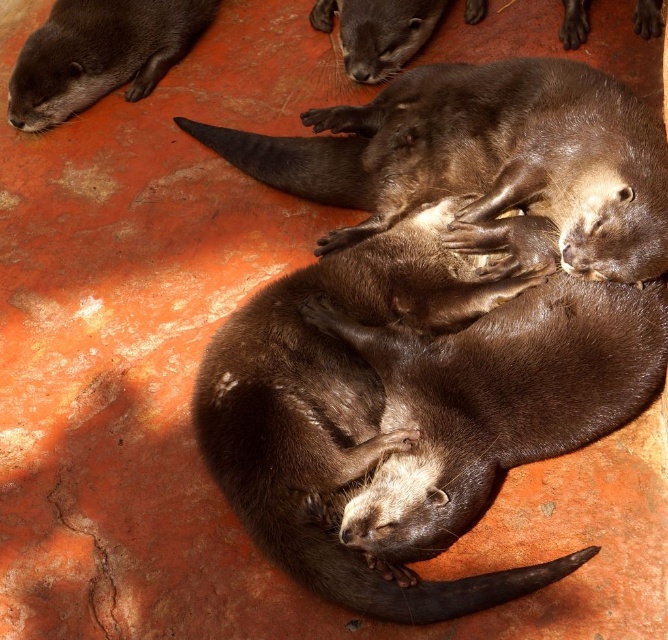
You are an animal caretaker observing the otters. You need to determine which otter is larger in height between the brown shiny otter at center and the shiny brown otter at upper left. Which one is taller?

The brown shiny otter at center is taller than the shiny brown otter at upper left.

You are observing two otters on a concrete surface. The brown shiny otter at center and the brown furry otter at center. Which one is positioned closer to you?

The brown shiny otter at center is closer to the viewer than the brown furry otter at center.

You are an animal caretaker observing the otters. You need to identify which otter is taller. Which one is taller between the brown furry otter at center and the shiny brown otter at upper left?

The brown furry otter at center is taller than the shiny brown otter at upper left according to the description.